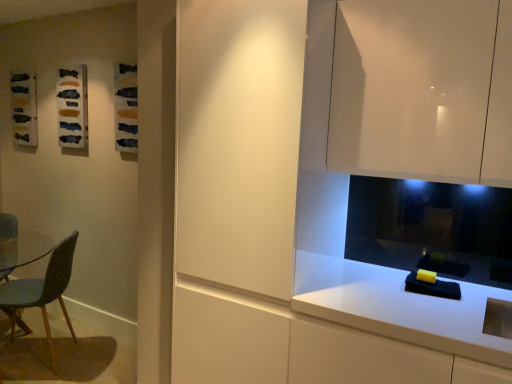
Question: Considering the relative positions of white glossy countertop at lower right and glossy white cabinet at upper right in the image provided, is white glossy countertop at lower right to the left or to the right of glossy white cabinet at upper right?

Choices:
 (A) right
 (B) left

Answer: (B)

Question: Considering the positions of white glossy countertop at lower right and glossy white cabinet at upper right in the image, is white glossy countertop at lower right wider or thinner than glossy white cabinet at upper right?

Choices:
 (A) wide
 (B) thin

Answer: (A)

Question: Which is nearer to the glossy white cabinet at upper right?

Choices:
 (A) matte textured fabric at upper left
 (B) white glossy countertop at lower right
 (C) matte white cabinet at center
 (D) blue fabric chair at left

Answer: (C)

Question: Estimate the real-world distances between objects in this image. Which object is farther from the white glossy countertop at lower right?

Choices:
 (A) blue fabric chair at left
 (B) matte textured fabric at upper left
 (C) glossy white cabinet at upper right
 (D) matte white cabinet at center

Answer: (B)